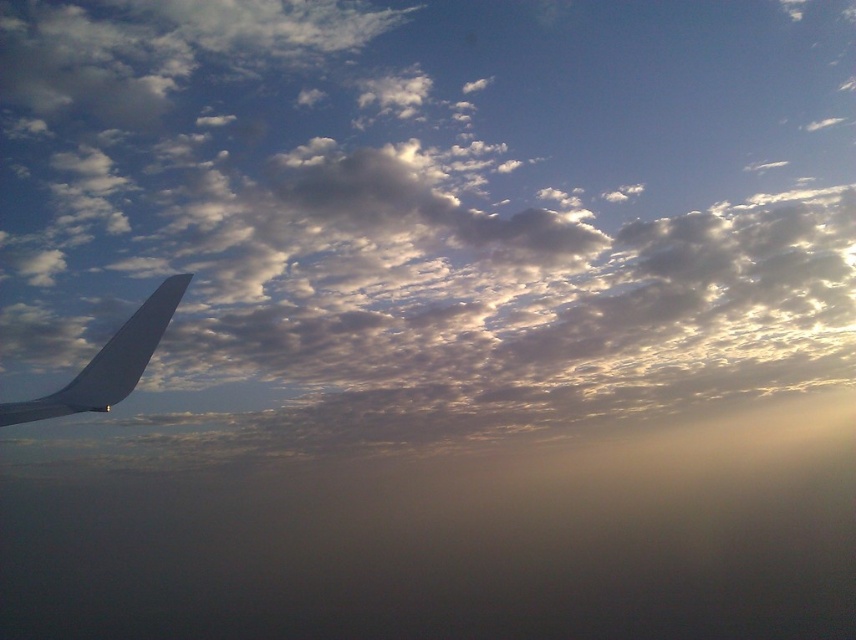
In the scene shown: Measure the distance between point (649, 422) and camera.

A distance of 25.80 meters exists between point (649, 422) and camera.

Can you confirm if white fluffy cloud at upper left is wider than matte gray wing at left?

Correct, the width of white fluffy cloud at upper left exceeds that of matte gray wing at left.

Locate an element on the screen. Image resolution: width=856 pixels, height=640 pixels. white fluffy cloud at upper left is located at coordinates tap(423, 216).